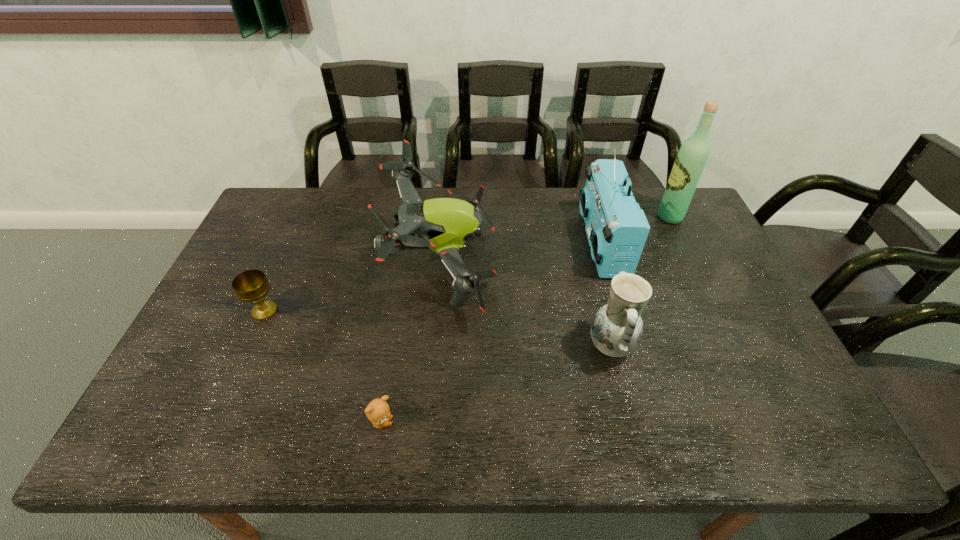
Identify the location of free space at the right edge of the desktop. (701, 266).

This screenshot has height=540, width=960. Identify the location of vacant region at the far left corner of the desktop. (281, 211).

Identify the location of free point at the near left corner. (143, 434).

Image resolution: width=960 pixels, height=540 pixels. Identify the location of blank space at the near right corner of the desktop. pos(750,424).

The height and width of the screenshot is (540, 960). What are the coordinates of `empty space between the radio receiver and the drone` in the screenshot? It's located at (522, 253).

You are a GUI agent. You are given a task and a screenshot of the screen. Output one action in this format:
    pyautogui.click(x=<x>, y=<y>)
    Task: Click on the free point between the teddy bear and the chalice
    
    Given the screenshot: What is the action you would take?
    pyautogui.click(x=323, y=367)

Image resolution: width=960 pixels, height=540 pixels. In order to click on unoccupied position between the fifth tallest object and the drone in this screenshot , I will do `click(353, 287)`.

Identify the location of free space between the third shortest object and the shortest object. The height and width of the screenshot is (540, 960). (496, 384).

At what (x,y) coordinates should I click in order to perform the action: click on vacant space that's between the shortest object and the wine bottle. Please return your answer as a coordinate pair (x, y). The image size is (960, 540). Looking at the image, I should click on [x=525, y=320].

In order to click on vacant space that is in between the teddy bear and the radio receiver in this screenshot , I will do `click(492, 333)`.